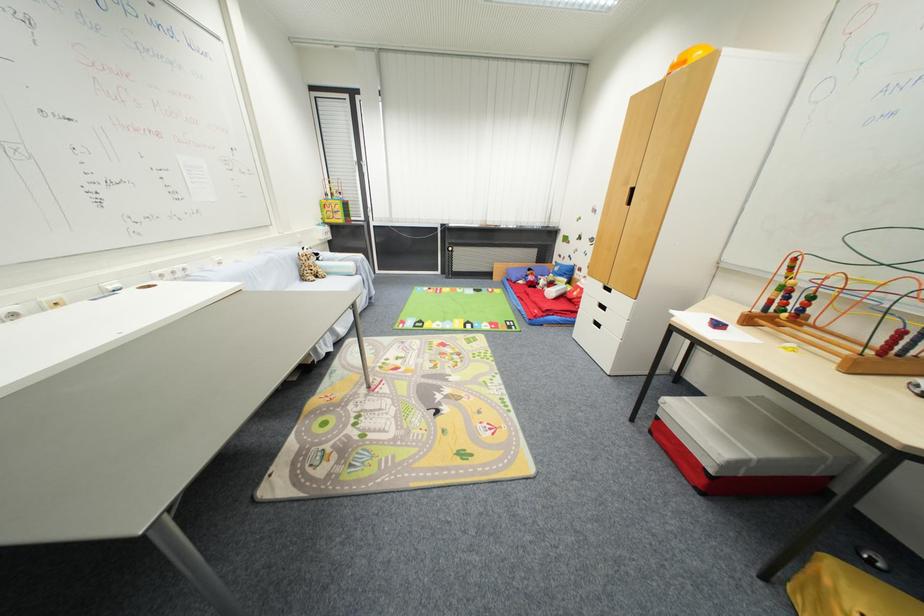
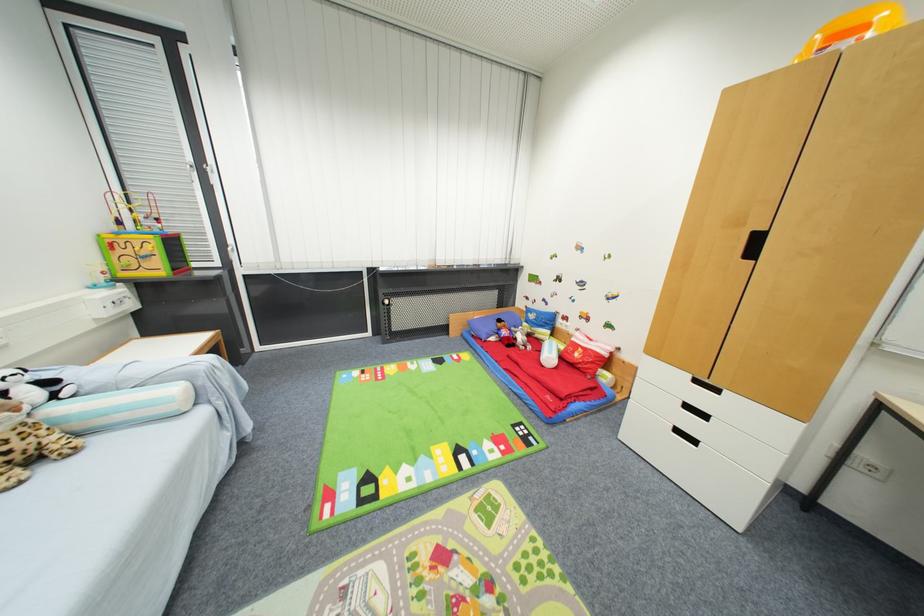
In the second image, find the point that corresponds to pixel 313 274 in the first image.

(7, 456)